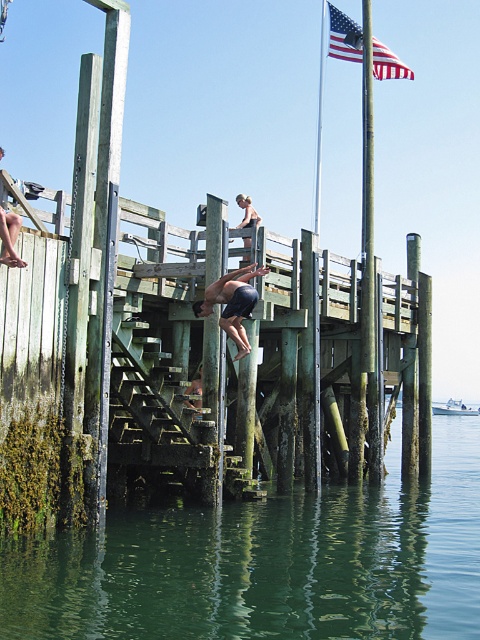
Which is behind, point (39, 396) or point (9, 220)?

The point (39, 396) is more distant.

Does point (168, 268) lie behind point (16, 253)?

Yes, it is behind point (16, 253).

Identify the location of green weathered wood dock at center. This screenshot has width=480, height=640. (187, 365).

Can you confirm if green mossy water at lower center is taller than american flag at upper center?

No, green mossy water at lower center is not taller than american flag at upper center.

Is point (44, 616) closer to camera compared to point (355, 40)?

Yes, point (44, 616) is closer to viewer.

You are a GUI agent. You are given a task and a screenshot of the screen. Output one action in this format:
    pyautogui.click(x=<x>, y=<y>)
    Task: Click on the green mossy water at lower center
    The width and height of the screenshot is (480, 640).
    Given the screenshot: What is the action you would take?
    pyautogui.click(x=267, y=563)

Measure the distance between point (x=371, y=442) and camera.

They are 31.00 meters apart.

The image size is (480, 640). What are the coordinates of `green wood pole at center` in the screenshot? It's located at (369, 253).

Is point (368, 40) in front of point (239, 324)?

No, it is not.

The image size is (480, 640). I want to click on green wood pole at center, so click(369, 253).